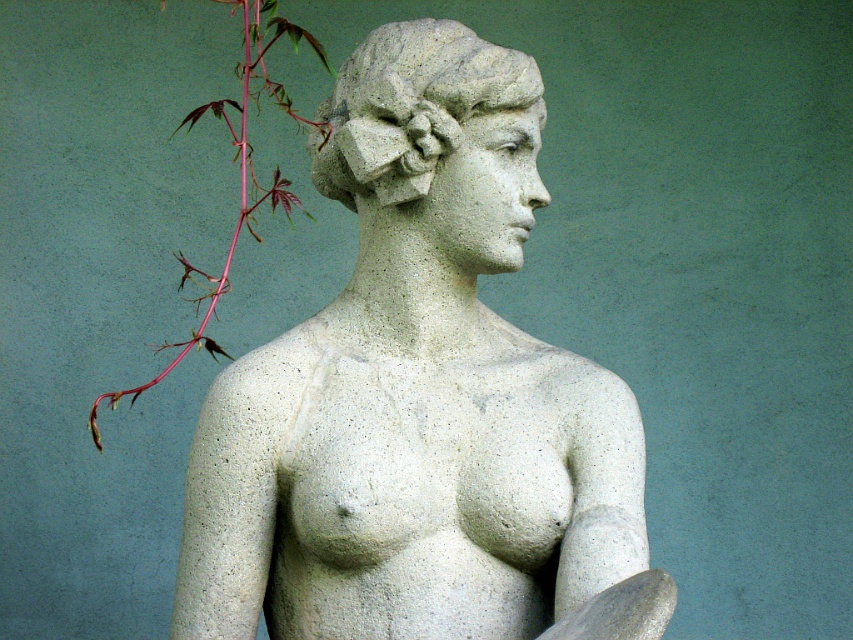
Question: Which point is farther to the camera?

Choices:
 (A) (207, 312)
 (B) (450, 67)

Answer: (A)

Question: Considering the relative positions of gray stone head at center and pink stem at left in the image provided, where is gray stone head at center located with respect to pink stem at left?

Choices:
 (A) above
 (B) below

Answer: (A)

Question: Is white stone statue at center to the right of gray stone head at center from the viewer's perspective?

Choices:
 (A) yes
 (B) no

Answer: (A)

Question: Is gray stone head at center to the left of pink stem at left from the viewer's perspective?

Choices:
 (A) no
 (B) yes

Answer: (A)

Question: Which point appears closest to the camera in this image?

Choices:
 (A) (460, 38)
 (B) (190, 113)

Answer: (A)

Question: Among these points, which one is farthest from the camera?

Choices:
 (A) (276, 483)
 (B) (245, 204)

Answer: (B)